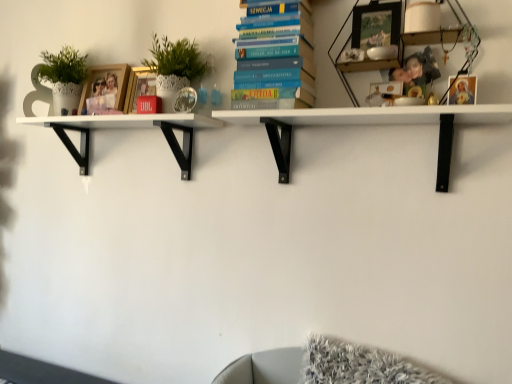
Question: From the image's perspective, is wooden photo frame at upper right, positioned as the first shelf in right-to-left order, beneath matte gold picture frame at upper right, the 1th picture frame positioned from the front?

Choices:
 (A) no
 (B) yes

Answer: (A)

Question: Considering the relative sizes of wooden photo frame at upper right, positioned as the first shelf in right-to-left order, and matte gold picture frame at upper right, the 1th picture frame positioned from the front, in the image provided, is wooden photo frame at upper right, positioned as the first shelf in right-to-left order, wider than matte gold picture frame at upper right, the 1th picture frame positioned from the front,?

Choices:
 (A) no
 (B) yes

Answer: (B)

Question: Considering the relative sizes of wooden photo frame at upper right, which is counted as the 3th shelf, starting from the left, and matte gold picture frame at upper right, which is the 4th picture frame in back-to-front order, in the image provided, is wooden photo frame at upper right, which is counted as the 3th shelf, starting from the left, thinner than matte gold picture frame at upper right, which is the 4th picture frame in back-to-front order,?

Choices:
 (A) no
 (B) yes

Answer: (A)

Question: Would you say wooden photo frame at upper right, which is counted as the 3th shelf, starting from the left, is outside matte gold picture frame at upper right, the first picture frame positioned from the right?

Choices:
 (A) no
 (B) yes

Answer: (B)

Question: Is wooden photo frame at upper right, positioned as the first shelf in right-to-left order, positioned behind matte gold picture frame at upper right, the 1th picture frame positioned from the front?

Choices:
 (A) no
 (B) yes

Answer: (A)

Question: Is matte gold picture frame at upper right, the 4th picture frame in the left-to-right sequence, a part of wooden photo frame at upper right, positioned as the first shelf in right-to-left order?

Choices:
 (A) yes
 (B) no

Answer: (A)

Question: Is blue hardcover book at center thinner than wooden photo frame at upper left, which is counted as the first picture frame, starting from the left?

Choices:
 (A) yes
 (B) no

Answer: (B)

Question: Considering the relative sizes of blue hardcover book at center and wooden photo frame at upper left, which ranks as the fourth picture frame in right-to-left order, in the image provided, is blue hardcover book at center smaller than wooden photo frame at upper left, which ranks as the fourth picture frame in right-to-left order,?

Choices:
 (A) no
 (B) yes

Answer: (A)

Question: Can you confirm if blue hardcover book at center is shorter than wooden photo frame at upper left, arranged as the 1th picture frame when viewed from the back?

Choices:
 (A) no
 (B) yes

Answer: (A)

Question: Does blue hardcover book at center turn towards wooden photo frame at upper left, the 4th picture frame when ordered from front to back?

Choices:
 (A) yes
 (B) no

Answer: (B)

Question: Can you confirm if blue hardcover book at center is positioned to the right of wooden photo frame at upper left, which ranks as the fourth picture frame in right-to-left order?

Choices:
 (A) no
 (B) yes

Answer: (B)

Question: Does blue hardcover book at center come in front of wooden photo frame at upper left, which is counted as the first picture frame, starting from the left?

Choices:
 (A) no
 (B) yes

Answer: (B)

Question: Is wooden photo frame at upper right, which is counted as the 3th shelf, starting from the left, inside wooden photo frame at upper left, which ranks as the fourth picture frame in right-to-left order?

Choices:
 (A) yes
 (B) no

Answer: (B)